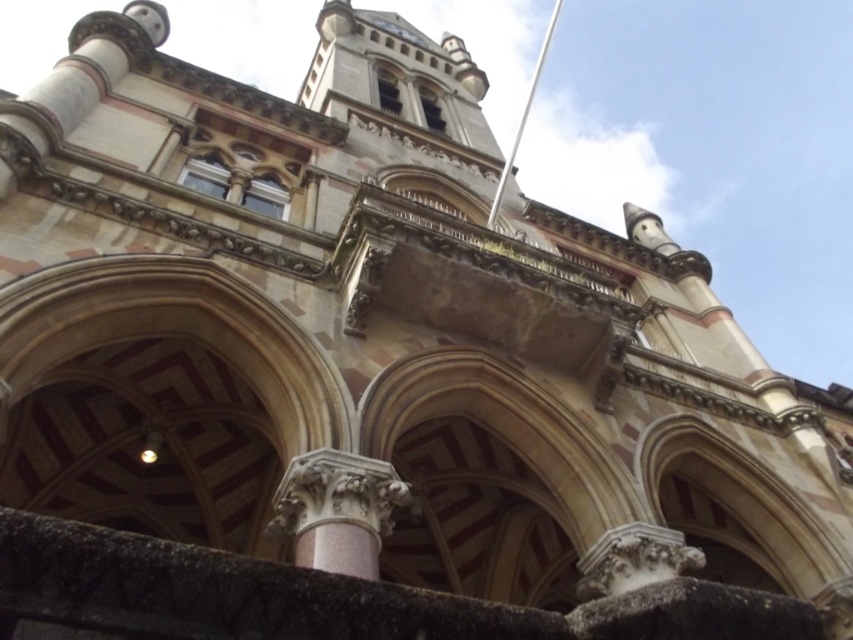
What do you see at coordinates (337, 509) in the screenshot? The width and height of the screenshot is (853, 640). I see `pink stone column at center` at bounding box center [337, 509].

Which is behind, point (405, 492) or point (494, 211)?

The point (494, 211) is behind.

This screenshot has width=853, height=640. I want to click on pink stone column at center, so click(x=337, y=509).